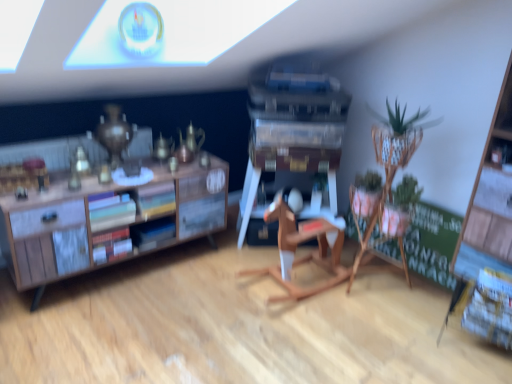
Where is `free spot below wooden rocking horse at center (from a real-world perspective)`? The height and width of the screenshot is (384, 512). free spot below wooden rocking horse at center (from a real-world perspective) is located at coordinates (293, 283).